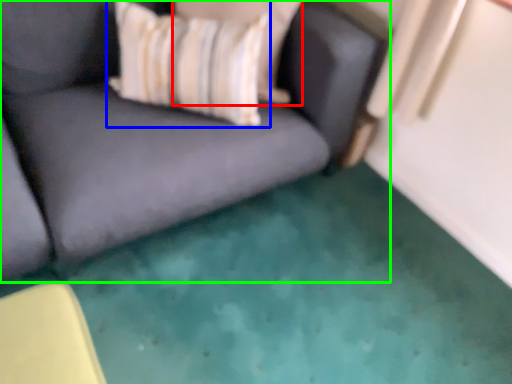
Question: Which object is the farthest from pillow (highlighted by a red box)? Choose among these: throw pillow (highlighted by a blue box) or studio couch (highlighted by a green box).

Choices:
 (A) throw pillow
 (B) studio couch

Answer: (B)